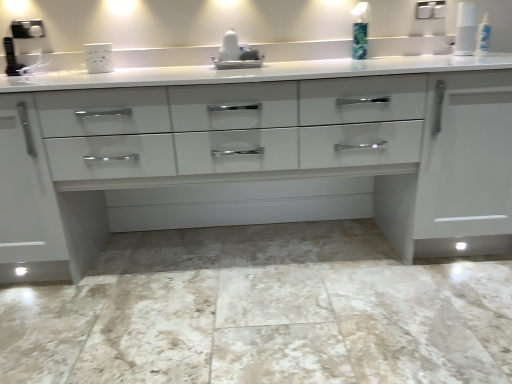
Question: Are green plastic soap dispenser at upper right and white matte mug at upper center located far from each other?

Choices:
 (A) no
 (B) yes

Answer: (B)

Question: Is green plastic soap dispenser at upper right shorter than white matte mug at upper center?

Choices:
 (A) no
 (B) yes

Answer: (A)

Question: From a real-world perspective, is green plastic soap dispenser at upper right located beneath white matte mug at upper center?

Choices:
 (A) no
 (B) yes

Answer: (A)

Question: Is the depth of green plastic soap dispenser at upper right greater than that of white matte mug at upper center?

Choices:
 (A) no
 (B) yes

Answer: (B)

Question: From the image's perspective, is green plastic soap dispenser at upper right under white matte mug at upper center?

Choices:
 (A) yes
 (B) no

Answer: (B)

Question: Looking at the image, does white glossy chest of drawers at center seem bigger or smaller compared to green plastic soap dispenser at upper right?

Choices:
 (A) small
 (B) big

Answer: (B)

Question: Is white glossy chest of drawers at center taller or shorter than green plastic soap dispenser at upper right?

Choices:
 (A) short
 (B) tall

Answer: (B)

Question: Looking at their shapes, would you say white glossy chest of drawers at center is wider or thinner than green plastic soap dispenser at upper right?

Choices:
 (A) thin
 (B) wide

Answer: (B)

Question: From a real-world perspective, relative to green plastic soap dispenser at upper right, is white glossy chest of drawers at center vertically above or below?

Choices:
 (A) above
 (B) below

Answer: (B)

Question: Is green plastic soap dispenser at upper right taller or shorter than white glossy chest of drawers at center?

Choices:
 (A) short
 (B) tall

Answer: (A)

Question: Considering their positions, is green plastic soap dispenser at upper right located in front of or behind white glossy chest of drawers at center?

Choices:
 (A) behind
 (B) front

Answer: (A)

Question: Is point (361, 8) closer or farther from the camera than point (392, 114)?

Choices:
 (A) closer
 (B) farther

Answer: (B)

Question: From the image's perspective, is green plastic soap dispenser at upper right above or below white glossy chest of drawers at center?

Choices:
 (A) below
 (B) above

Answer: (B)

Question: Visually, is white glossy sink at center positioned to the left or to the right of marble tile floor at center?

Choices:
 (A) left
 (B) right

Answer: (A)

Question: Is white glossy sink at center taller or shorter than marble tile floor at center?

Choices:
 (A) short
 (B) tall

Answer: (B)